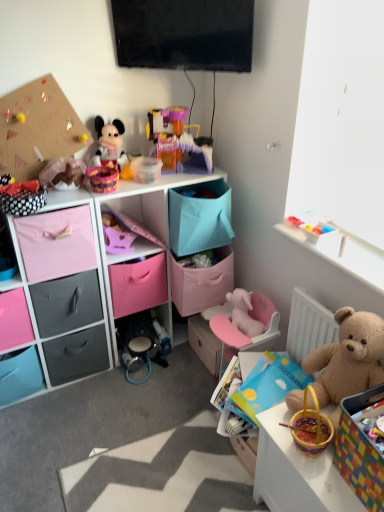
What is the approximate height of pink fabric drawer at center, arranged as the 6th drawer when viewed from the left?

pink fabric drawer at center, arranged as the 6th drawer when viewed from the left, is 12.00 inches in height.

Locate an element on the screen. The image size is (384, 512). multicolored woven basket at lower right is located at coordinates (360, 451).

Identify the location of pink plush elephant at center, acting as the fourth toy starting from the top. The height and width of the screenshot is (512, 384). (244, 313).

Find the location of a particular element. pink fabric drawer at lower left, the second drawer viewed from the left is located at coordinates (14, 320).

This screenshot has height=512, width=384. Describe the element at coordinates (63, 172) in the screenshot. I see `fuzzy brown teddy bear at upper left, which ranks as the 2th toy in bottom-to-top order` at that location.

Describe the element at coordinates (297, 472) in the screenshot. Image resolution: width=384 pixels, height=512 pixels. I see `multicolored woven basket at lower right` at that location.

Measure the distance between point [268,496] and camera.

Point [268,496] and camera are 1.43 meters apart.

Locate an element on the screen. The image size is (384, 512). pink fabric drawer at center, arranged as the 6th drawer when viewed from the left is located at coordinates (138, 284).

Based on their sizes in the image, would you say multicolored woven basket at lower right is bigger or smaller than pink fabric drawer at center, the second drawer in the right-to-left sequence?

multicolored woven basket at lower right is bigger than pink fabric drawer at center, the second drawer in the right-to-left sequence.

Is point (279, 432) positioned before point (138, 306)?

Yes.

Is multicolored woven basket at lower right turned away from pink fabric drawer at center, arranged as the 6th drawer when viewed from the left?

No, multicolored woven basket at lower right's orientation is not away from pink fabric drawer at center, arranged as the 6th drawer when viewed from the left.

From a real-world perspective, is multicolored woven basket at lower right physically above pink fabric drawer at center, the second drawer in the right-to-left sequence?

No, from a real-world perspective, multicolored woven basket at lower right is not above pink fabric drawer at center, the second drawer in the right-to-left sequence.

From the image's perspective, is pink fabric drawer at lower left, the second drawer viewed from the left, located above matte black drawer at left, the 5th drawer in the right-to-left sequence?

No, from the image's perspective, pink fabric drawer at lower left, the second drawer viewed from the left, is not over matte black drawer at left, the 5th drawer in the right-to-left sequence.

What's the angular difference between pink fabric drawer at lower left, which ranks as the 6th drawer in right-to-left order, and matte black drawer at left, the 5th drawer in the right-to-left sequence,'s facing directions?

They differ by 0.000153 degrees in their facing directions.

Which of these two, pink fabric drawer at lower left, which ranks as the 6th drawer in right-to-left order, or matte black drawer at left, which appears as the 3th drawer when viewed from the left, is thinner?

With smaller width is matte black drawer at left, which appears as the 3th drawer when viewed from the left.

From the picture: Is pink fabric drawer at lower left, which ranks as the 6th drawer in right-to-left order, positioned with its back to matte black drawer at left, the 5th drawer in the right-to-left sequence?

No, matte black drawer at left, the 5th drawer in the right-to-left sequence, is not at the back of pink fabric drawer at lower left, which ranks as the 6th drawer in right-to-left order.

Would you say multicolored woven basket at lower right is a long distance from matte black drawer at lower left, placed as the 4th drawer when sorted from right to left?

multicolored woven basket at lower right is far away from matte black drawer at lower left, placed as the 4th drawer when sorted from right to left.

Can you tell me how much multicolored woven basket at lower right and matte black drawer at lower left, the 4th drawer in the left-to-right sequence, differ in facing direction?

The angular difference between multicolored woven basket at lower right and matte black drawer at lower left, the 4th drawer in the left-to-right sequence, is 92.7 degrees.

Is multicolored woven basket at lower right at the left side of matte black drawer at lower left, placed as the 4th drawer when sorted from right to left?

Incorrect, multicolored woven basket at lower right is not on the left side of matte black drawer at lower left, placed as the 4th drawer when sorted from right to left.

Is the depth of multicolored woven basket at lower right greater than that of matte black drawer at lower left, the 4th drawer in the left-to-right sequence?

That is False.

From a real-world perspective, which is physically below, pink fabric drawer at left, the third drawer viewed from the right, or multicolored woven basket at lower right?

multicolored woven basket at lower right is physically lower.

Who is taller, pink fabric drawer at left, which appears as the fifth drawer when viewed from the left, or multicolored woven basket at lower right?

multicolored woven basket at lower right.

Is multicolored woven basket at lower right a part of pink fabric drawer at left, the third drawer viewed from the right?

No, multicolored woven basket at lower right is not a part of pink fabric drawer at left, the third drawer viewed from the right.

Based on the photo, which object is positioned more to the left, pink fabric drawer at left, which appears as the fifth drawer when viewed from the left, or multicolored woven basket at lower right?

Positioned to the left is pink fabric drawer at left, which appears as the fifth drawer when viewed from the left.

From the picture: How distant is matte black drawer at lower left, the 4th drawer in the left-to-right sequence, from pink fabric drawer at lower left, the second drawer viewed from the left?

They are 9.04 inches apart.

Is matte black drawer at lower left, placed as the 4th drawer when sorted from right to left, directly adjacent to pink fabric drawer at lower left, the second drawer viewed from the left?

There is a gap between matte black drawer at lower left, placed as the 4th drawer when sorted from right to left, and pink fabric drawer at lower left, the second drawer viewed from the left.

Choose the correct answer: Is matte black drawer at lower left, the 4th drawer in the left-to-right sequence, inside pink fabric drawer at lower left, which ranks as the 6th drawer in right-to-left order, or outside it?

matte black drawer at lower left, the 4th drawer in the left-to-right sequence, is located beyond the bounds of pink fabric drawer at lower left, which ranks as the 6th drawer in right-to-left order.

Considering the relative sizes of matte black drawer at lower left, the 4th drawer in the left-to-right sequence, and pink fabric drawer at lower left, the second drawer viewed from the left, in the image provided, is matte black drawer at lower left, the 4th drawer in the left-to-right sequence, taller than pink fabric drawer at lower left, the second drawer viewed from the left,?

No.

From the image's perspective, is plush mickey mouse at upper left, placed as the 2th toy when sorted from left to right, located above pink fabric drawer at center, the second drawer in the right-to-left sequence?

Yes, from the image's perspective, plush mickey mouse at upper left, placed as the 2th toy when sorted from left to right, is over pink fabric drawer at center, the second drawer in the right-to-left sequence.

Looking at this image, who is smaller, plush mickey mouse at upper left, which is counted as the 3th toy, starting from the right, or pink fabric drawer at center, the second drawer in the right-to-left sequence?

plush mickey mouse at upper left, which is counted as the 3th toy, starting from the right.

Considering the sizes of objects plush mickey mouse at upper left, the 3th toy when ordered from bottom to top, and pink fabric drawer at center, the second drawer in the right-to-left sequence, in the image provided, who is wider, plush mickey mouse at upper left, the 3th toy when ordered from bottom to top, or pink fabric drawer at center, the second drawer in the right-to-left sequence,?

With larger width is pink fabric drawer at center, the second drawer in the right-to-left sequence.

Can you see plush mickey mouse at upper left, placed as the 2th toy when sorted from left to right, touching pink fabric drawer at center, arranged as the 6th drawer when viewed from the left?

No, plush mickey mouse at upper left, placed as the 2th toy when sorted from left to right, is not touching pink fabric drawer at center, arranged as the 6th drawer when viewed from the left.

Would you say translucent plastic playset at upper center, which ranks as the second toy in right-to-left order, is a long distance from pink plush elephant at center, which ranks as the first toy in right-to-left order?

Actually, translucent plastic playset at upper center, which ranks as the second toy in right-to-left order, and pink plush elephant at center, which ranks as the first toy in right-to-left order, are a little close together.

Can you confirm if translucent plastic playset at upper center, positioned as the fourth toy in bottom-to-top order, is taller than pink plush elephant at center, the 4th toy positioned from the left?

Yes, translucent plastic playset at upper center, positioned as the fourth toy in bottom-to-top order, is taller than pink plush elephant at center, the 4th toy positioned from the left.

From a real-world perspective, which object stands above the other?

translucent plastic playset at upper center, arranged as the third toy when viewed from the left.

From the picture: Considering the sizes of objects translucent plastic playset at upper center, which ranks as the second toy in right-to-left order, and pink plush elephant at center, which appears as the 1th toy when ordered from the bottom, in the image provided, who is thinner, translucent plastic playset at upper center, which ranks as the second toy in right-to-left order, or pink plush elephant at center, which appears as the 1th toy when ordered from the bottom,?

With smaller width is pink plush elephant at center, which appears as the 1th toy when ordered from the bottom.

Starting from the multicolored woven basket at lower right, which drawer is the 5th one behind? Please provide its 2D coordinates.

[(138, 284)]

Where is `the 1st drawer in front of the matte black drawer at left, which appears as the 3th drawer when viewed from the left, counting from the anchor's position`? This screenshot has width=384, height=512. the 1st drawer in front of the matte black drawer at left, which appears as the 3th drawer when viewed from the left, counting from the anchor's position is located at coordinates (14, 320).

Looking at the image, which one is located further to fluffy beige teddy bear at right, multicolored woven basket at lower right or plush mickey mouse at upper left, placed as the 2th toy when sorted from left to right?

plush mickey mouse at upper left, placed as the 2th toy when sorted from left to right.

From the image, which object appears to be nearer to pink fabric drawer at center, arranged as the 6th drawer when viewed from the left, matte black drawer at lower left, the 4th drawer in the left-to-right sequence, or pink plush elephant at center, which appears as the 1th toy when ordered from the bottom?

matte black drawer at lower left, the 4th drawer in the left-to-right sequence, is positioned closer to the anchor pink fabric drawer at center, arranged as the 6th drawer when viewed from the left.

Estimate the real-world distances between objects in this image. Which object is closer to multicolored woven basket at lower right, pink fabric drawer at center, the first drawer in the right-to-left sequence, or plush mickey mouse at upper left, the 3th toy when ordered from bottom to top?

Among the two, pink fabric drawer at center, the first drawer in the right-to-left sequence, is located nearer to multicolored woven basket at lower right.

Looking at the image, which one is located closer to pink fabric drawer at left, the third drawer viewed from the right, pink fabric drawer at center, arranged as the 6th drawer when viewed from the left, or pink fabric storage unit at center?

The object closer to pink fabric drawer at left, the third drawer viewed from the right, is pink fabric storage unit at center.

In the scene shown: From the image, which object appears to be farther from multicolored woven basket at lower right, pink plush elephant at center, the 4th toy positioned from the left, or multicolored woven basket at lower right?

Among the two, pink plush elephant at center, the 4th toy positioned from the left, is located further to multicolored woven basket at lower right.

From the image, which object appears to be farther from fluffy beige teddy bear at right, pink fabric drawer at center, the second drawer in the right-to-left sequence, or black flat-screen tv at upper center?

black flat-screen tv at upper center.

From the image, which object appears to be nearer to pink plush elephant at center, which appears as the 1th toy when ordered from the bottom, pink fabric storage unit at center or black flat-screen tv at upper center?

pink fabric storage unit at center.

When comparing their distances from multicolored woven basket at lower right, does black flat-screen tv at upper center or pink fabric drawer at center, the second drawer in the right-to-left sequence, seem further?

black flat-screen tv at upper center is positioned further to the anchor multicolored woven basket at lower right.

Locate an element on the screen. toy between plush mickey mouse at upper left, the 3th toy when ordered from bottom to top, and matte black drawer at left, the 5th drawer in the right-to-left sequence, vertically is located at coordinates (63, 172).

I want to click on desk located between pink fabric storage unit at center and multicolored woven basket at lower right in the left-right direction, so click(x=297, y=472).

You are a GUI agent. You are given a task and a screenshot of the screen. Output one action in this format:
    pyautogui.click(x=<x>, y=<y>)
    Task: Click on the storage box that lies between black flat-screen tv at upper center and pink fabric drawer at lower left, which appears as the seventh drawer when viewed from the right, from top to bottom
    The image size is (384, 512).
    Given the screenshot: What is the action you would take?
    pyautogui.click(x=360, y=451)

Where is `cabinetry situated between matte black drawer at lower left, the 4th drawer in the left-to-right sequence, and pink fabric drawer at center, the 7th drawer positioned from the left, from left to right`? cabinetry situated between matte black drawer at lower left, the 4th drawer in the left-to-right sequence, and pink fabric drawer at center, the 7th drawer positioned from the left, from left to right is located at coordinates (100, 281).